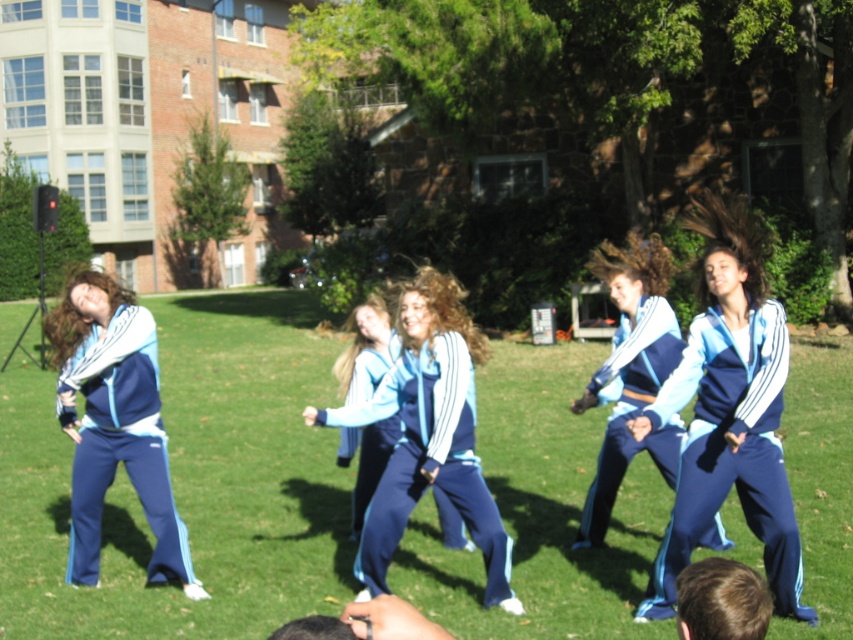
Question: Does matte blue tracksuit at left have a greater width compared to matte blue tracksuit at center?

Choices:
 (A) yes
 (B) no

Answer: (A)

Question: Which object appears closest to the camera in this image?

Choices:
 (A) matte blue tracksuit at center
 (B) blue/white track suit at center

Answer: (B)

Question: Which of the following is the farthest from the observer?

Choices:
 (A) (674, 428)
 (B) (752, 429)
 (C) (135, 352)
 (D) (387, 452)

Answer: (D)

Question: Can you confirm if green grass at center is positioned below blue/white track suit at center?

Choices:
 (A) no
 (B) yes

Answer: (A)

Question: Can you confirm if blue/white track suit at center is positioned to the left of matte blue tracksuit at center?

Choices:
 (A) no
 (B) yes

Answer: (A)

Question: Which is farther from the green grass at center?

Choices:
 (A) matte blue tracksuit at center
 (B) blue track suit at center
 (C) matte blue tracksuit at left

Answer: (A)